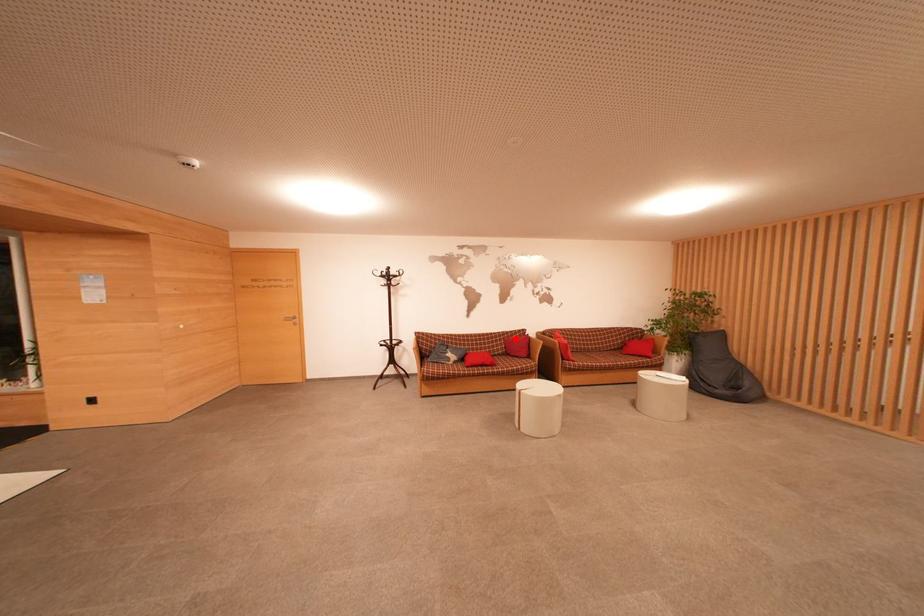
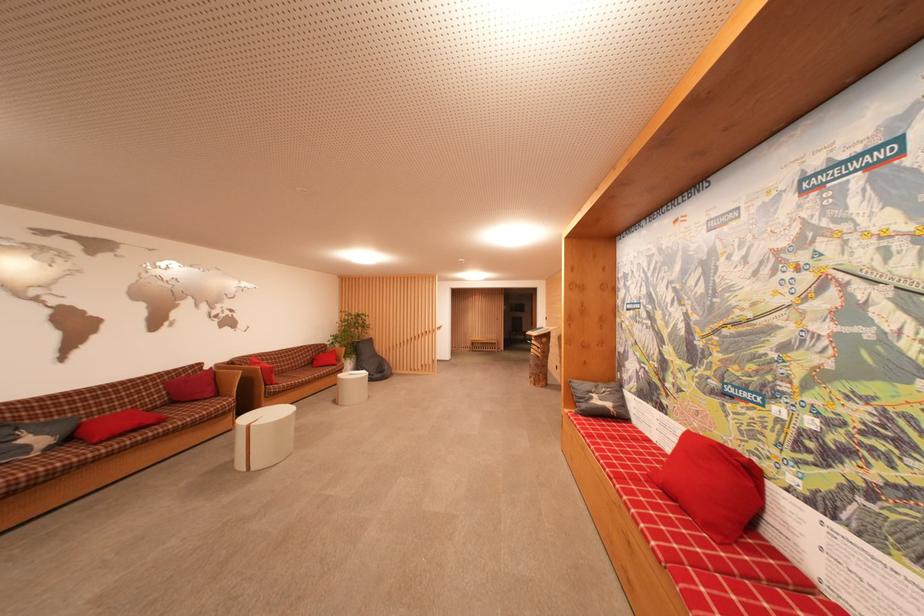
Locate, in the second image, the point that corresponds to the highlighted location in the first image.

(183, 378)